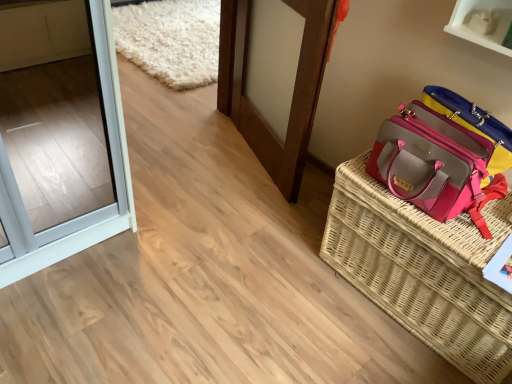
Describe the element at coordinates (423, 270) in the screenshot. I see `pink woven picnic basket at right` at that location.

Measure the distance between pink fabric handbag at right and camera.

The depth of pink fabric handbag at right is 4.17 feet.

Where is `pink woven picnic basket at right`? The width and height of the screenshot is (512, 384). pink woven picnic basket at right is located at coordinates (423, 270).

Considering the sizes of pink woven picnic basket at right and brown wooden door at center in the image, is pink woven picnic basket at right taller or shorter than brown wooden door at center?

Considering their sizes, pink woven picnic basket at right has less height than brown wooden door at center.

Is pink woven picnic basket at right to the left of brown wooden door at center from the viewer's perspective?

No, pink woven picnic basket at right is not to the left of brown wooden door at center.

Which object is wider, brown wooden door at center or pink fabric handbag at right?

With larger width is pink fabric handbag at right.

Which is nearer, (292, 133) or (469, 154)?

The point (469, 154) is in front.

Is pink fabric handbag at right shorter than brown wooden door at center?

Yes.

Looking at this image, would you say pink fabric handbag at right is inside or outside brown wooden door at center?

pink fabric handbag at right is located beyond the bounds of brown wooden door at center.

From the image's perspective, relative to brown wooden door at center, is pink fabric handbag at right above or below?

pink fabric handbag at right is situated lower than brown wooden door at center in the image.

Is there a large distance between pink fabric handbag at right and brown wooden door at center?

No, pink fabric handbag at right is in close proximity to brown wooden door at center.

From a real-world perspective, does brown wooden door at center sit lower than pink woven picnic basket at right?

No, from a real-world perspective, brown wooden door at center is not under pink woven picnic basket at right.

Does brown wooden door at center have a greater height compared to pink woven picnic basket at right?

Correct, brown wooden door at center is much taller as pink woven picnic basket at right.

In the scene shown: Would you say brown wooden door at center is a long distance from pink woven picnic basket at right?

They are positioned close to each other.

Which is more to the right, brown wooden door at center or pink woven picnic basket at right?

pink woven picnic basket at right is more to the right.

Which point is more forward, (410, 156) or (416, 251)?

Positioned in front is point (410, 156).

Looking at this image, can you tell me how much pink fabric handbag at right and pink woven picnic basket at right differ in facing direction?

The facing directions of pink fabric handbag at right and pink woven picnic basket at right are 9.49e-05 degrees apart.

Is pink fabric handbag at right surrounding pink woven picnic basket at right?

Definitely not — pink woven picnic basket at right is not inside pink fabric handbag at right.

Where is `handbag behind the pink woven picnic basket at right`? handbag behind the pink woven picnic basket at right is located at coordinates (435, 164).

Which object is wider, pink woven picnic basket at right or pink fabric handbag at right?

Wider between the two is pink woven picnic basket at right.

Considering the positions of objects pink woven picnic basket at right and pink fabric handbag at right in the image provided, who is more to the right, pink woven picnic basket at right or pink fabric handbag at right?

Positioned to the right is pink woven picnic basket at right.

Find the location of a particular element. Image resolution: width=512 pixels, height=384 pixels. door positioned vertically above the pink woven picnic basket at right (from a real-world perspective) is located at coordinates (293, 90).

The height and width of the screenshot is (384, 512). I want to click on door that appears on the left of pink fabric handbag at right, so click(x=293, y=90).

When comparing their distances from brown wooden door at center, does pink woven picnic basket at right or pink fabric handbag at right seem closer?

pink fabric handbag at right is positioned closer to the anchor brown wooden door at center.

Based on their spatial positions, is brown wooden door at center or pink fabric handbag at right further from pink woven picnic basket at right?

brown wooden door at center lies further to pink woven picnic basket at right than the other object.

From the image, which object appears to be nearer to pink fabric handbag at right, pink woven picnic basket at right or brown wooden door at center?

pink woven picnic basket at right is positioned closer to the anchor pink fabric handbag at right.

Consider the image. When comparing their distances from brown wooden door at center, does pink fabric handbag at right or pink woven picnic basket at right seem closer?

Among the two, pink fabric handbag at right is located nearer to brown wooden door at center.

Estimate the real-world distances between objects in this image. Which object is further from pink fabric handbag at right, brown wooden door at center or pink woven picnic basket at right?

brown wooden door at center lies further to pink fabric handbag at right than the other object.

Considering their positions, is pink fabric handbag at right positioned closer to pink woven picnic basket at right than brown wooden door at center?

pink fabric handbag at right is positioned closer to the anchor pink woven picnic basket at right.

Find the location of a particular element. The width and height of the screenshot is (512, 384). handbag that lies between brown wooden door at center and pink woven picnic basket at right from top to bottom is located at coordinates (435, 164).